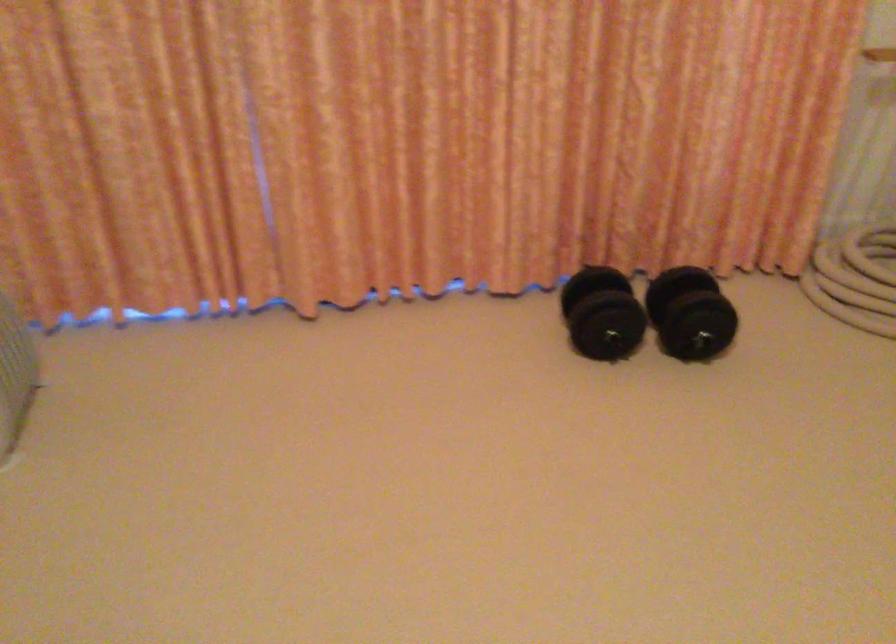
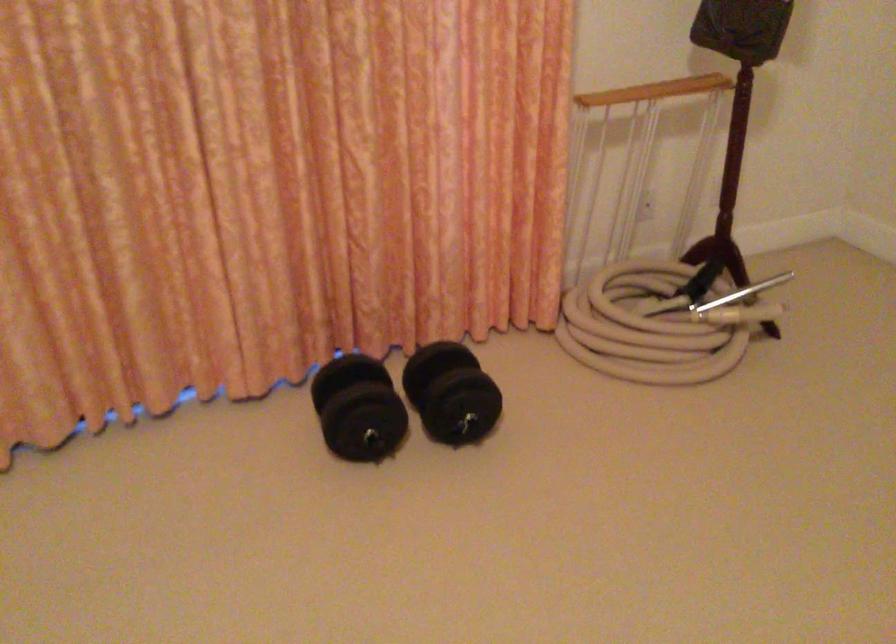
In the second image, find the point that corresponds to the point at 602,312 in the first image.

(358, 408)